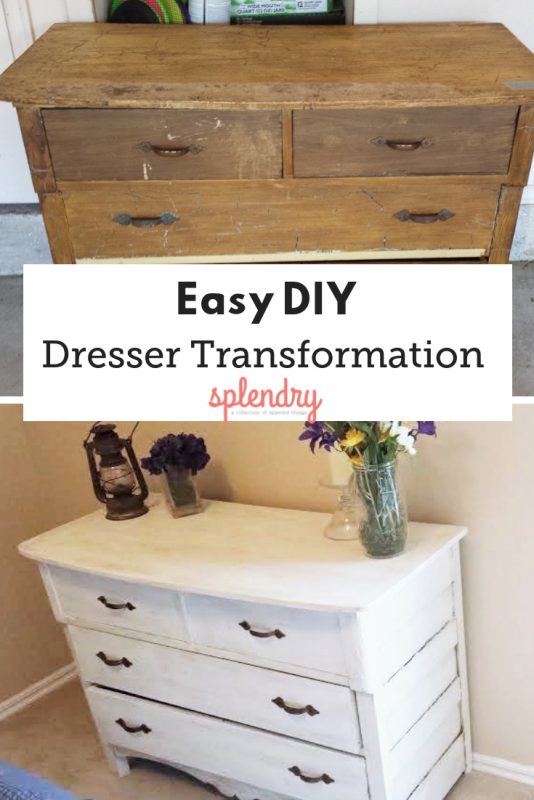
The width and height of the screenshot is (534, 800). In order to click on lamp in this screenshot , I will do `click(114, 468)`.